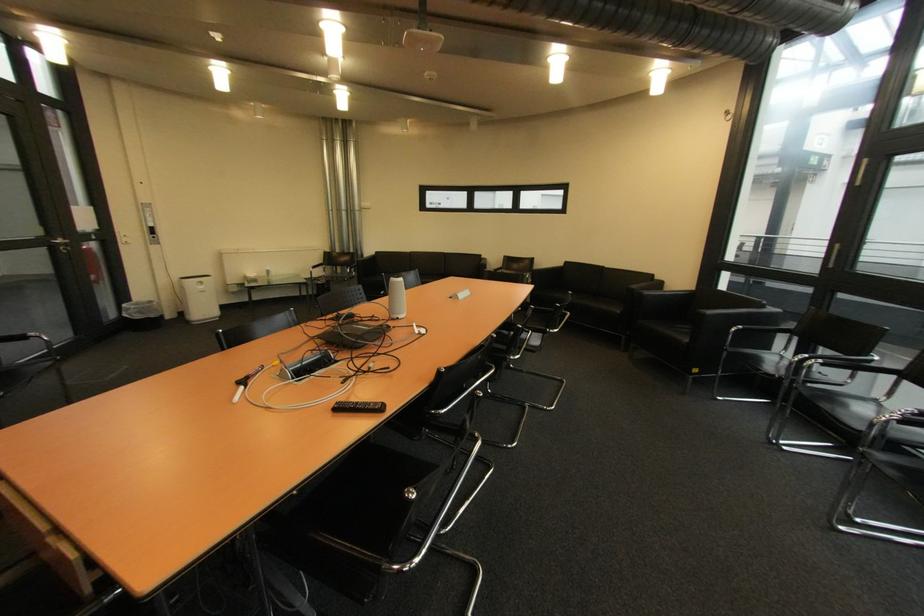
What do you see at coordinates (604, 288) in the screenshot?
I see `the sofa sitting surface` at bounding box center [604, 288].